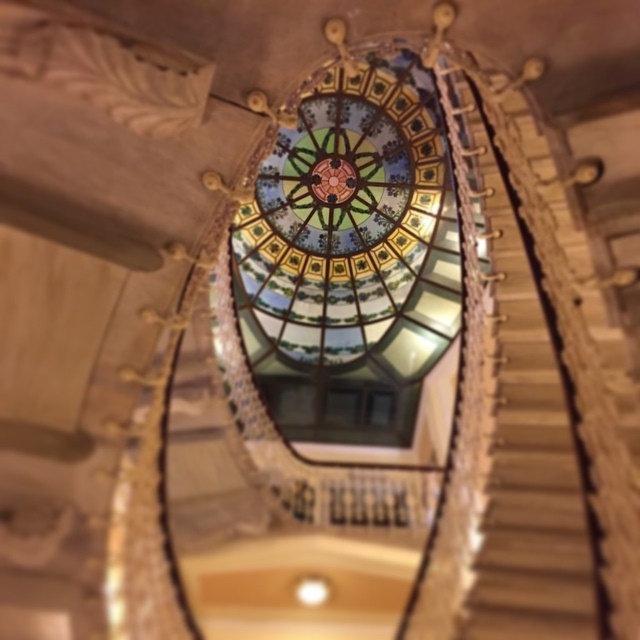
Between stained glass dome at center and wooden at center, which one is positioned lower?

wooden at center is lower down.

Between stained glass dome at center and wooden at center, which one has more height?

stained glass dome at center is taller.

Does point (355, 248) come behind point (492, 445)?

Yes, it is.

At what (x,y) coordinates should I click in order to perform the action: click on stained glass dome at center. Please return your answer as a coordinate pair (x, y). Looking at the image, I should click on (349, 257).